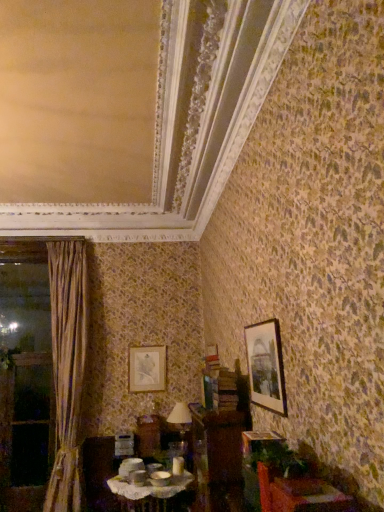
Question: Is wooden window frame at left situated inside brown wooden dresser at center or outside?

Choices:
 (A) outside
 (B) inside

Answer: (A)

Question: Is point (13, 410) closer or farther from the camera than point (200, 431)?

Choices:
 (A) closer
 (B) farther

Answer: (B)

Question: Which object is the closest to the matte silver picture frame at center, which appears as the first picture frame when ordered from the bottom?

Choices:
 (A) brown wooden dresser at center
 (B) wooden table at lower right, marked as the 2th table in a left-to-right arrangement
 (C) wooden window frame at left
 (D) silky beige curtain at left
 (E) matte black picture frame at upper right, acting as the 1th picture frame starting from the front

Answer: (D)

Question: Which object is positioned farthest from the matte black picture frame at upper right, acting as the 1th picture frame starting from the front?

Choices:
 (A) green leafy plant at lower right
 (B) silky beige curtain at left
 (C) matte ceramic bowls at center, the 2th table positioned from the front
 (D) wooden window frame at left
 (E) matte white lampshade at center

Answer: (D)